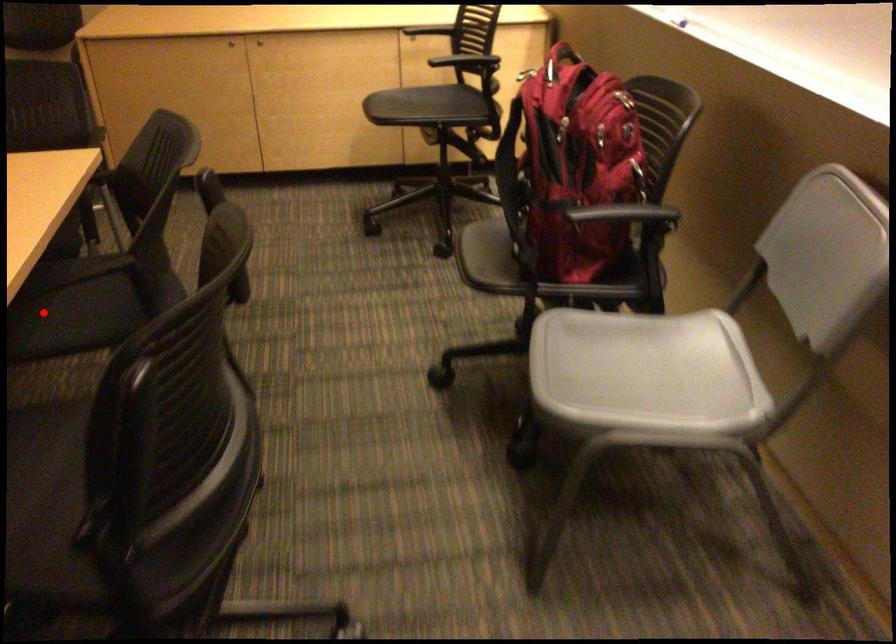
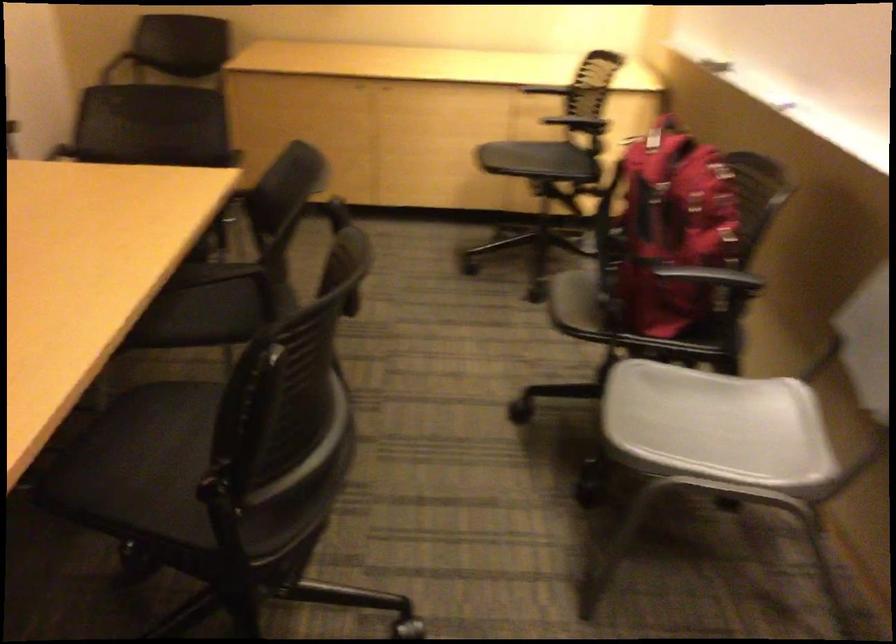
Question: I am providing you with two images of the same scene from different viewpoints. A red point is marked on the first image. At the location where the point appears in image 1, is it still visible in image 2?

Choices:
 (A) Yes
 (B) No

Answer: (B)